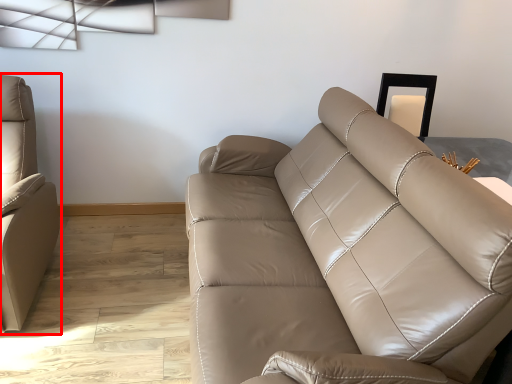
Question: In this image, where is studio couch (annotated by the red box) located relative to studio couch?

Choices:
 (A) right
 (B) left

Answer: (B)